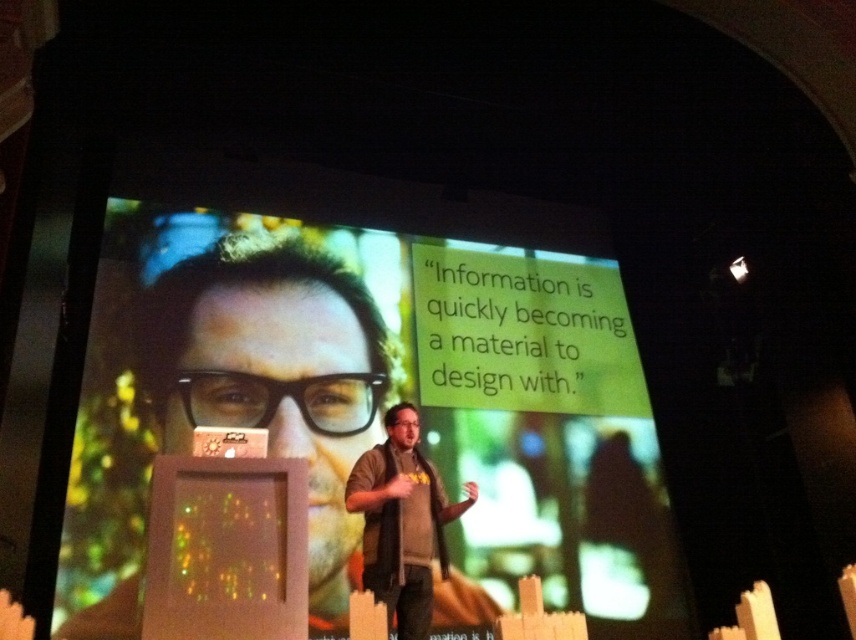
You are an event organizer who needs to adjust the seating arrangement for the audience. You want to ensure that the audience can clearly see both the matte black screen at center and the dark brown leather jacket at center worn by the speaker. Given that the screen is wider than the jacket, which object should you prioritize placing in the center of the front row for optimal visibility?

The matte black screen at center should be prioritized in the center of the front row since it is wider than the dark brown leather jacket at center, ensuring that the audience can see the entire content of the screen without obstruction.

You are attending a presentation and want to focus on the speaker wearing the dark brown leather jacket at center. Where should you look relative to the matte black screen at center?

The dark brown leather jacket at center is to the right of the matte black screen at center, so you should look to the right side of the screen to focus on the speaker wearing the dark brown leather jacket at center.